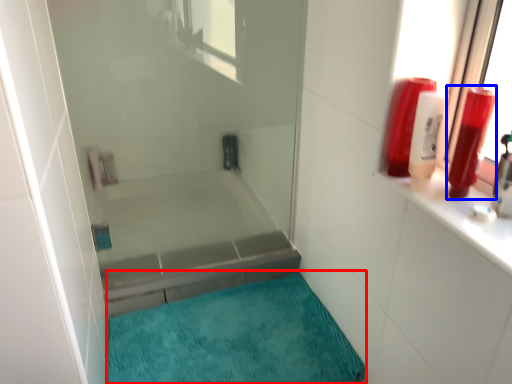
Question: Among these objects, which one is farthest to the camera, bath mat (highlighted by a red box) or toiletry (highlighted by a blue box)?

Choices:
 (A) bath mat
 (B) toiletry

Answer: (A)